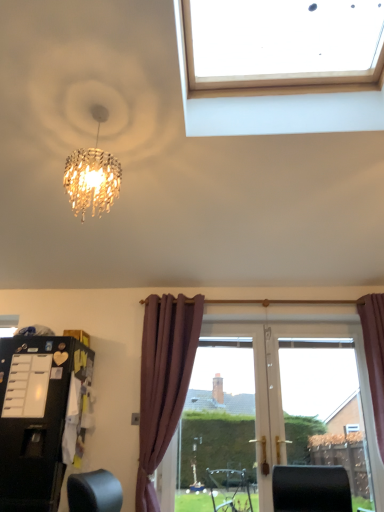
The height and width of the screenshot is (512, 384). Describe the element at coordinates (374, 356) in the screenshot. I see `purple velvet curtain at right` at that location.

Measure the distance between point (x=383, y=403) and camera.

Point (x=383, y=403) and camera are 3.30 meters apart from each other.

Where is `purple velvet curtain at right`? This screenshot has width=384, height=512. purple velvet curtain at right is located at coordinates (374, 356).

Describe the element at coordinates (36, 417) in the screenshot. I see `black matte refrigerator at lower left` at that location.

The width and height of the screenshot is (384, 512). In order to click on black matte refrigerator at lower left in this screenshot , I will do `click(36, 417)`.

You are a GUI agent. You are given a task and a screenshot of the screen. Output one action in this format:
    pyautogui.click(x=<x>, y=<y>)
    Task: Click on the purple velvet curtain at right
    
    Given the screenshot: What is the action you would take?
    pyautogui.click(x=374, y=356)

Considering the positions of objects black matte refrigerator at lower left and purple velvet curtain at right in the image provided, who is more to the right, black matte refrigerator at lower left or purple velvet curtain at right?

purple velvet curtain at right is more to the right.

Which is behind, black matte refrigerator at lower left or purple velvet curtain at right?

purple velvet curtain at right is behind.

Which is nearer, (81, 371) or (371, 349)?

Positioned in front is point (81, 371).

From the image's perspective, would you say black matte refrigerator at lower left is shown under purple velvet curtain at right?

Yes.

From a real-world perspective, is black matte refrigerator at lower left under purple velvet curtain at right?

Indeed, from a real-world perspective, black matte refrigerator at lower left is positioned beneath purple velvet curtain at right.

Does black matte refrigerator at lower left have a lesser width compared to purple velvet curtain at right?

No, black matte refrigerator at lower left is not thinner than purple velvet curtain at right.

Can you confirm if black matte refrigerator at lower left is shorter than purple velvet curtain at right?

Correct, black matte refrigerator at lower left is not as tall as purple velvet curtain at right.

In terms of size, does black matte refrigerator at lower left appear bigger or smaller than purple velvet curtain at right?

black matte refrigerator at lower left is bigger than purple velvet curtain at right.

Is black matte refrigerator at lower left inside or outside of purple velvet curtain at right?

black matte refrigerator at lower left cannot be found inside purple velvet curtain at right.

Would you consider black matte refrigerator at lower left to be distant from purple velvet curtain at right?

Yes.

Is black matte refrigerator at lower left turned away from purple velvet curtain at right?

black matte refrigerator at lower left is not turned away from purple velvet curtain at right.

At what (x,y) coordinates should I click in order to perform the action: click on curtain above the black matte refrigerator at lower left (from the image's perspective). Please return your answer as a coordinate pair (x, y). This screenshot has width=384, height=512. Looking at the image, I should click on (374, 356).

Between purple velvet curtain at right and black matte refrigerator at lower left, which one appears on the left side from the viewer's perspective?

Positioned to the left is black matte refrigerator at lower left.

Based on the photo, does purple velvet curtain at right lie behind black matte refrigerator at lower left?

Yes, purple velvet curtain at right is further from the camera.

Between point (374, 323) and point (33, 484), which one is positioned in front?

The point (33, 484) is more forward.

From the image's perspective, is purple velvet curtain at right above black matte refrigerator at lower left?

Correct, purple velvet curtain at right appears higher than black matte refrigerator at lower left in the image.

From the picture: From a real-world perspective, which is physically below, purple velvet curtain at right or black matte refrigerator at lower left?

black matte refrigerator at lower left.

Which object is thinner, purple velvet curtain at right or black matte refrigerator at lower left?

With smaller width is purple velvet curtain at right.

Is purple velvet curtain at right shorter than black matte refrigerator at lower left?

No.

Who is smaller, purple velvet curtain at right or black matte refrigerator at lower left?

Smaller between the two is purple velvet curtain at right.

Can black matte refrigerator at lower left be found inside purple velvet curtain at right?

No, purple velvet curtain at right does not contain black matte refrigerator at lower left.

Is purple velvet curtain at right not close to black matte refrigerator at lower left?

That's right, there is a large distance between purple velvet curtain at right and black matte refrigerator at lower left.

Is purple velvet curtain at right facing towards black matte refrigerator at lower left?

No.

How many degrees apart are the facing directions of purple velvet curtain at right and black matte refrigerator at lower left?

1.6 degrees separate the facing orientations of purple velvet curtain at right and black matte refrigerator at lower left.

Measure the distance from purple velvet curtain at right to black matte refrigerator at lower left.

purple velvet curtain at right is 2.48 meters from black matte refrigerator at lower left.

Locate an element on the screen. dresser on the left of the purple velvet curtain at right is located at coordinates (36, 417).

Locate an element on the screen. curtain on the right of black matte refrigerator at lower left is located at coordinates (374, 356).

Find the location of a particular element. This screenshot has height=512, width=384. curtain behind the black matte refrigerator at lower left is located at coordinates (374, 356).